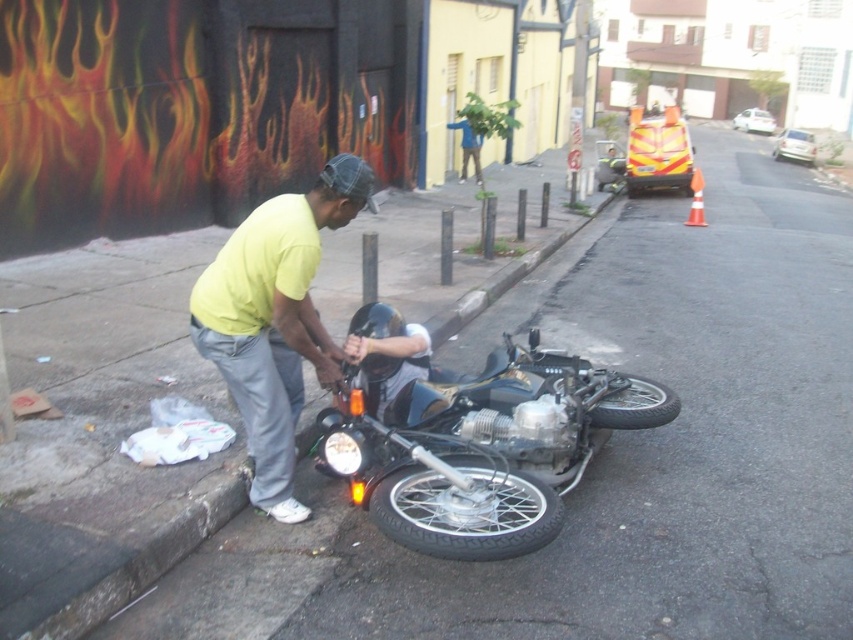
You are a pedestrian standing on the sidewalk observing the scene. Which object is positioned to the right of the other between the shiny chrome motorcycle at center and the yellow matte shirt at center?

The shiny chrome motorcycle at center is to the right of the yellow matte shirt at center.

You are a photographer trying to capture the scene of the man fixing the motorcycle. You want to ensure both the yellow matte shirt at center and the black rubber tire at lower center are clearly visible in your shot. Based on their sizes, which object should you focus on first to ensure proper framing?

The yellow matte shirt at center is wider than the black rubber tire at lower center, so you should focus on the yellow matte shirt at center first to ensure proper framing since it occupies more space in the scene.